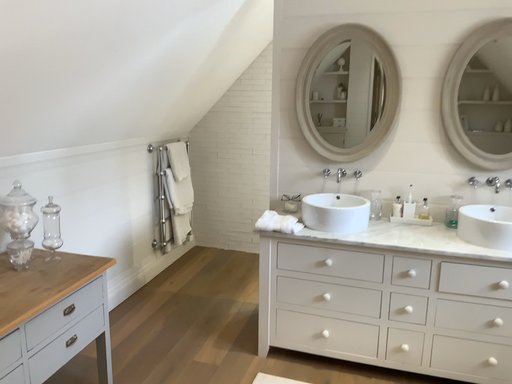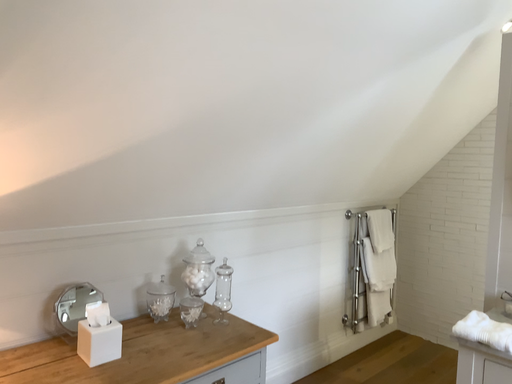
Question: How did the camera likely rotate when shooting the video?

Choices:
 (A) rotated left
 (B) rotated right

Answer: (A)